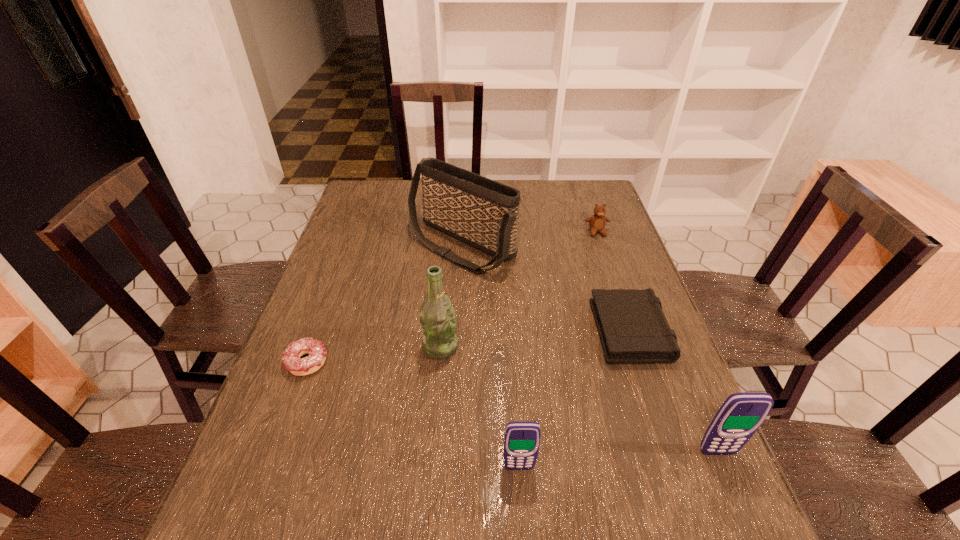
This screenshot has width=960, height=540. I want to click on free space between the shortest object and the third shortest object, so click(x=452, y=297).

The image size is (960, 540). I want to click on free space between the teddy bear and the beer bottle, so click(x=518, y=289).

Where is `empty space between the sixth tallest object and the handbag`? The height and width of the screenshot is (540, 960). empty space between the sixth tallest object and the handbag is located at coordinates (545, 286).

Identify the location of free space between the beer bottle and the left cellular telephone. This screenshot has height=540, width=960. (480, 407).

This screenshot has height=540, width=960. I want to click on free space between the beer bottle and the handbag, so click(451, 296).

Locate an element on the screen. The image size is (960, 540). free point between the handbag and the teddy bear is located at coordinates (529, 239).

Locate which object is the third closest to the shorter cellular telephone. Please provide its 2D coordinates. Your answer should be formatted as a tuple, i.e. [(x, y)], where the tuple contains the x and y coordinates of a point satisfying the conditions above.

[(741, 414)]

This screenshot has width=960, height=540. Find the location of `object that stands as the sixth closest to the beer bottle`. object that stands as the sixth closest to the beer bottle is located at coordinates (597, 222).

At what (x,y) coordinates should I click in order to perform the action: click on vacant space that satisfies the following two spatial constraints: 1. at the face of the Bible; 2. on the right side of the teddy bear. Please return your answer as a coordinate pair (x, y). The image size is (960, 540). Looking at the image, I should click on (630, 327).

Locate an element on the screen. This screenshot has height=540, width=960. free space that satisfies the following two spatial constraints: 1. at the face of the sixth tallest object; 2. on the right side of the teddy bear is located at coordinates coord(630,327).